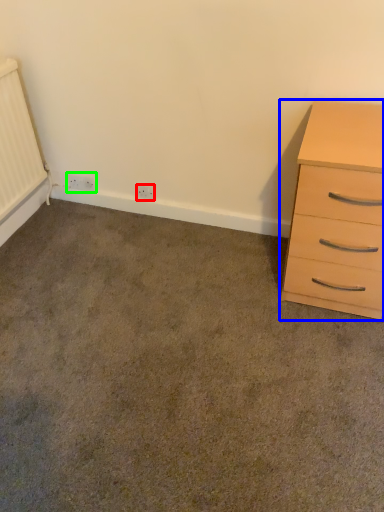
Question: Estimate the real-world distances between objects in this image. Which object is closer to electric outlet (highlighted by a red box), chest of drawers (highlighted by a blue box) or electric outlet (highlighted by a green box)?

Choices:
 (A) chest of drawers
 (B) electric outlet

Answer: (B)